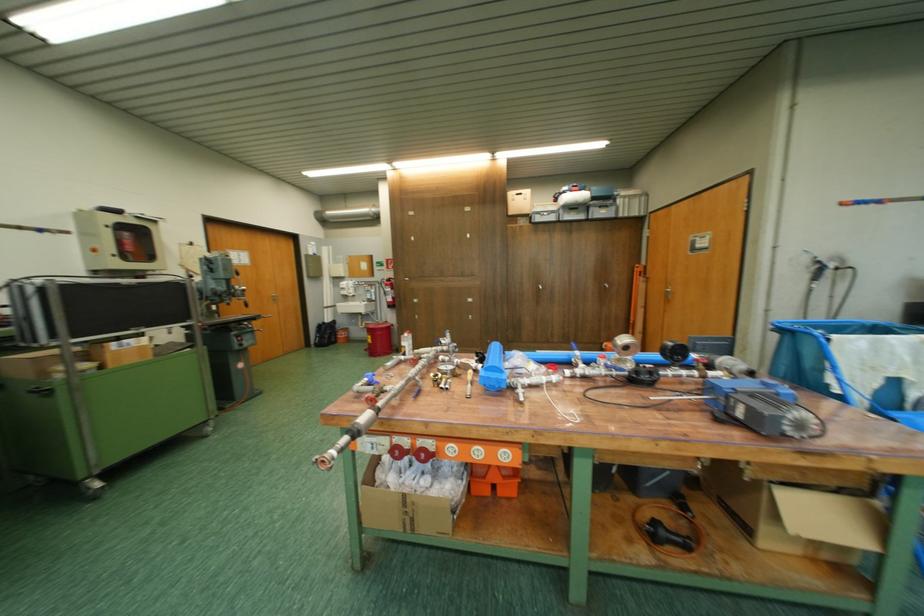
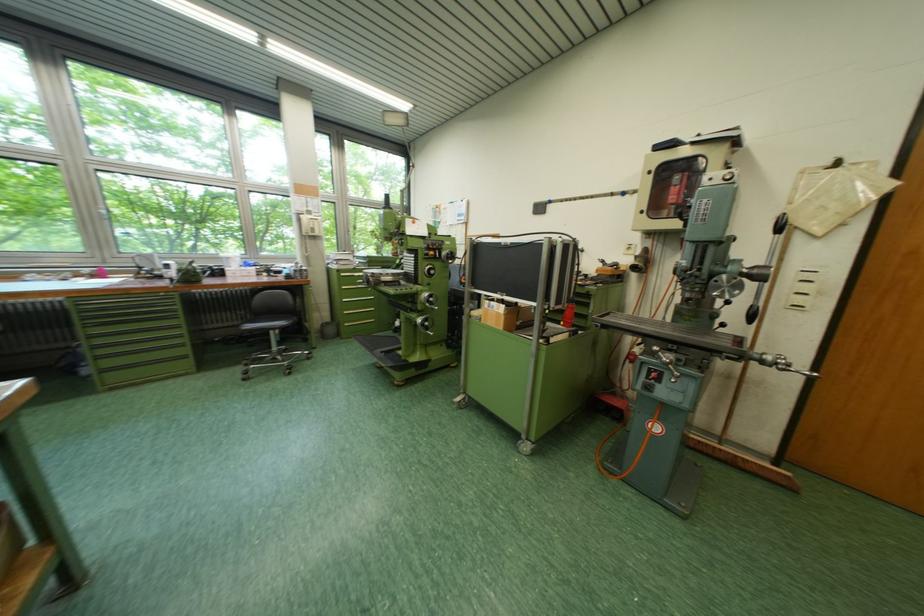
Find the pixel in the second image that matches (135,344) in the first image.

(503, 305)